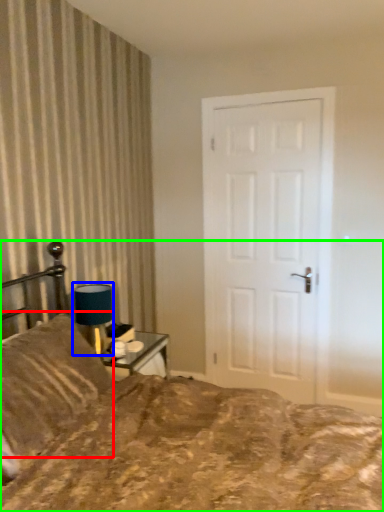
Question: Which is farther away from pillow (highlighted by a red box)? table lamp (highlighted by a blue box) or bed (highlighted by a green box)?

Choices:
 (A) table lamp
 (B) bed

Answer: (A)